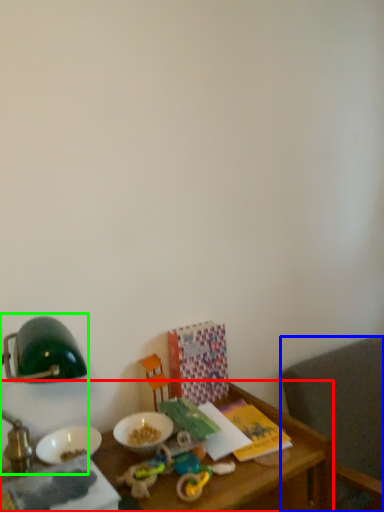
Question: Which object is the farthest from table (highlighted by a red box)? Choose among these: chair (highlighted by a blue box) or bedside lamp (highlighted by a green box).

Choices:
 (A) chair
 (B) bedside lamp

Answer: (A)